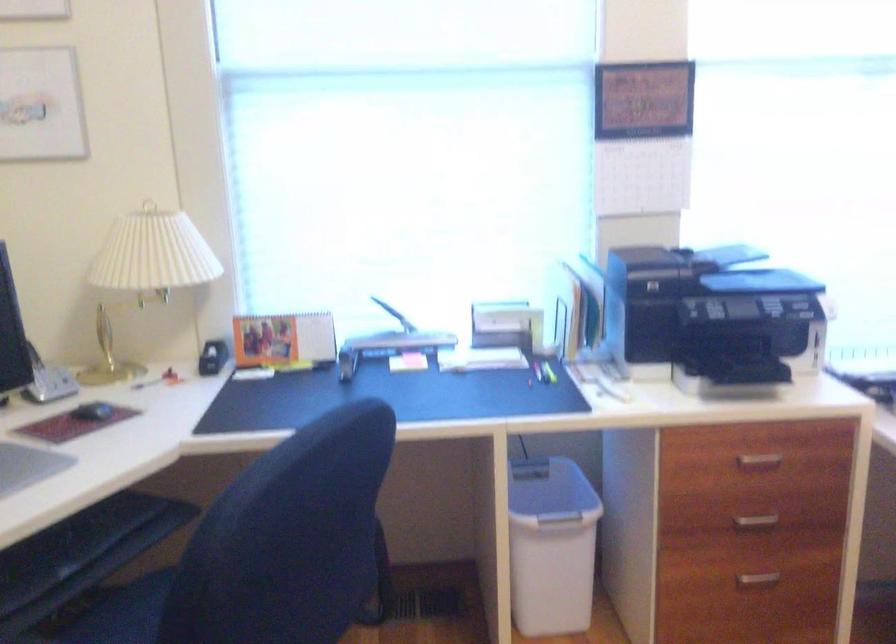
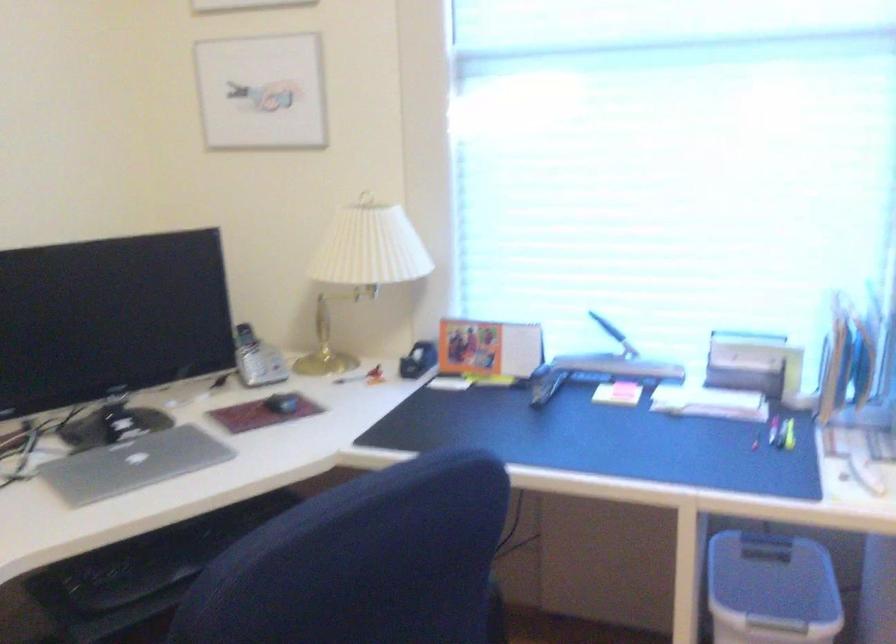
Question: I am providing you with two images of the same scene from different viewpoints. Please identify which objects are invisible in image2.

Choices:
 (A) stapler handle
 (B) closed silver laptop
 (C) silver cordless phone
 (D) none of these

Answer: (D)